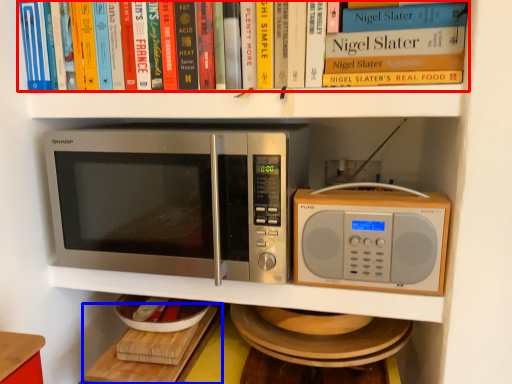
Question: Which point is further to the camera, book (highlighted by a red box) or table (highlighted by a blue box)?

Choices:
 (A) book
 (B) table

Answer: (B)